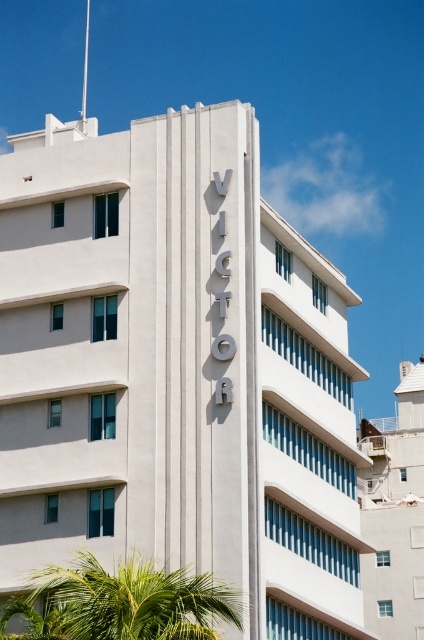
You are standing in front of the modernist building and want to locate the green leafy palm tree at lower left. Can you see the point at coordinates (122, 604) on it?

Yes, the point at coordinates (122, 604) is located on the green leafy palm tree at lower left.

You are standing in front of the modernist building and notice the green leafy palm tree at lower left and the white smooth building at upper center. Which object is positioned to the left of the other?

The green leafy palm tree at lower left is positioned to the left of the white smooth building at upper center.